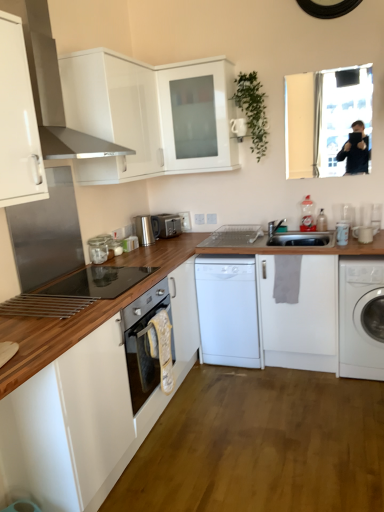
Identify the location of vacant region in front of satin silver toaster at center, positioned as the fourth appliance in front-to-back order. (171, 240).